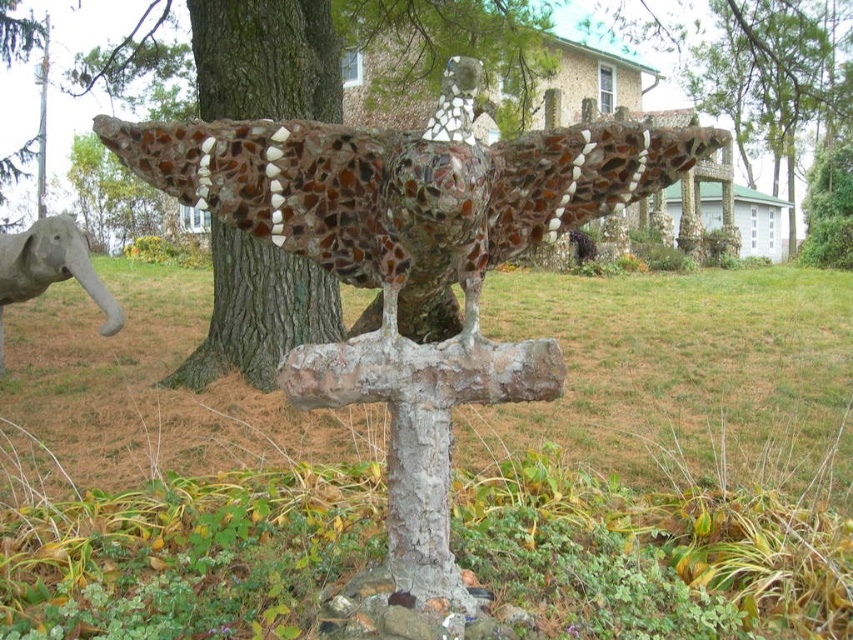
Is brown rough bark at center wider than gray stone elephant at lower left?

Incorrect, brown rough bark at center's width does not surpass gray stone elephant at lower left's.

Measure the distance between brown rough bark at center and gray stone elephant at lower left.

A distance of 1.46 meters exists between brown rough bark at center and gray stone elephant at lower left.

Who is more distant from viewer, (219, 10) or (62, 244)?

The point (62, 244) is more distant.

Image resolution: width=853 pixels, height=640 pixels. Identify the location of brown rough bark at center. (265, 58).

Can you confirm if mosaic glass bird at center is positioned to the left of mosaic stone bird at center?

Incorrect, mosaic glass bird at center is not on the left side of mosaic stone bird at center.

Can you confirm if mosaic glass bird at center is shorter than mosaic stone bird at center?

Yes, mosaic glass bird at center is shorter than mosaic stone bird at center.

Is point (352, 342) less distant than point (326, 92)?

Yes, point (352, 342) is in front of point (326, 92).

Identify the location of mosaic glass bird at center. The height and width of the screenshot is (640, 853). (410, 259).

Is mosaic glass bird at center behind gray stone elephant at lower left?

No, it is not.

Is point (345, 387) behind point (108, 320)?

No, it is not.

I want to click on mosaic glass bird at center, so click(x=410, y=259).